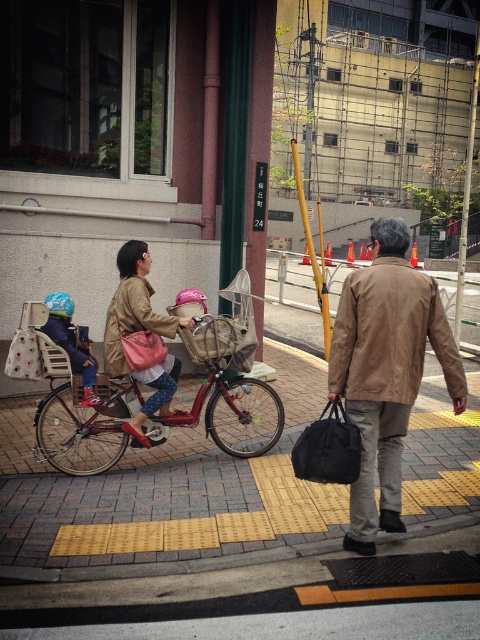
Between brown leather jacket at center and matte brown jacket at center, which one appears on the right side from the viewer's perspective?

brown leather jacket at center

What do you see at coordinates (385, 371) in the screenshot? This screenshot has height=640, width=480. I see `brown leather jacket at center` at bounding box center [385, 371].

Which is in front, point (394, 509) or point (154, 404)?

Positioned in front is point (394, 509).

Where is `brown leather jacket at center`? The height and width of the screenshot is (640, 480). brown leather jacket at center is located at coordinates (385, 371).

Is metallic red bicycle at center further to camera compared to matte brown jacket at center?

No, it is in front of matte brown jacket at center.

Between point (273, 401) and point (192, 321), which one is positioned behind?

The point (273, 401) is more distant.

The width and height of the screenshot is (480, 640). What do you see at coordinates (226, 396) in the screenshot?
I see `metallic red bicycle at center` at bounding box center [226, 396].

Locate an element on the screen. metallic red bicycle at center is located at coordinates (226, 396).

Who is positioned more to the left, matte brown jacket at center or matte blue helmet at left?

matte blue helmet at left is more to the left.

Measure the distance from matte brown jacket at center to matte blue helmet at left.

13.69 inches

Who is more distant from viewer, (x=165, y=385) or (x=84, y=387)?

The point (x=165, y=385) is behind.

At what (x,y) coordinates should I click in order to perform the action: click on matte brown jacket at center. Please return your answer as a coordinate pair (x, y). Looking at the image, I should click on (140, 333).